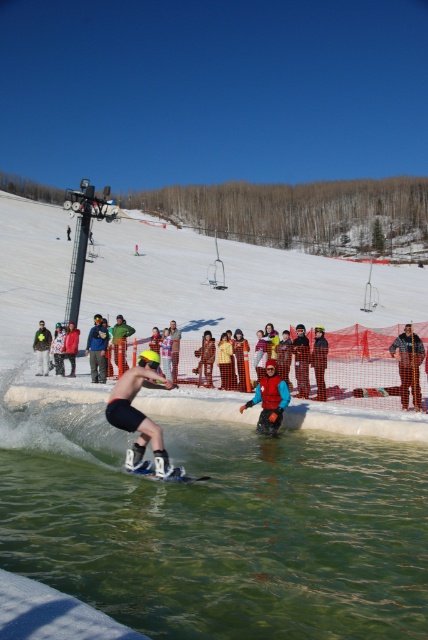
You are a photographer positioned at the edge of the ski resort, and you need to capture a wide shot of the clear water at center and the matte black snowboard at center. Considering their widths, which object will occupy more space horizontally in your photo?

The clear water at center has a greater width than the matte black snowboard at center, so it will occupy more horizontal space in the photo.